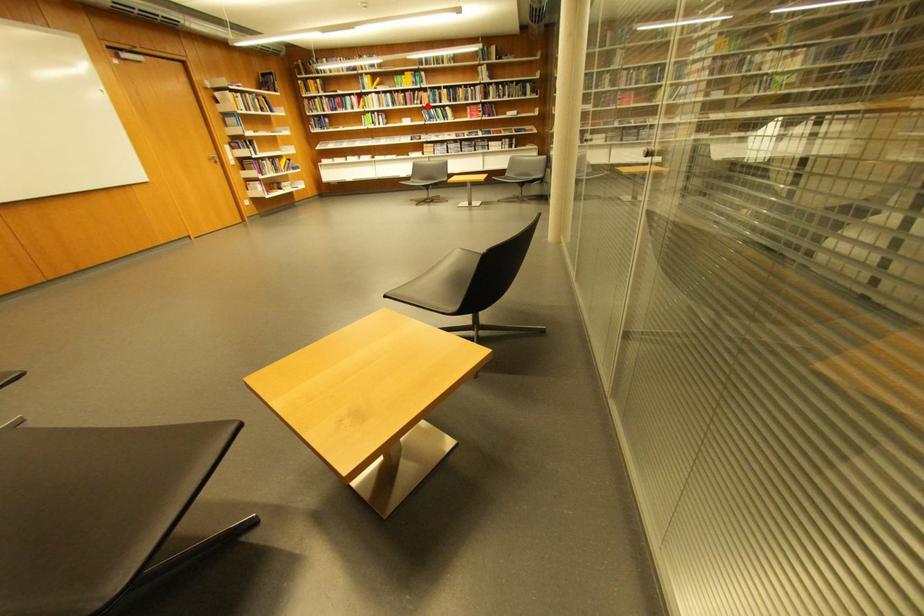
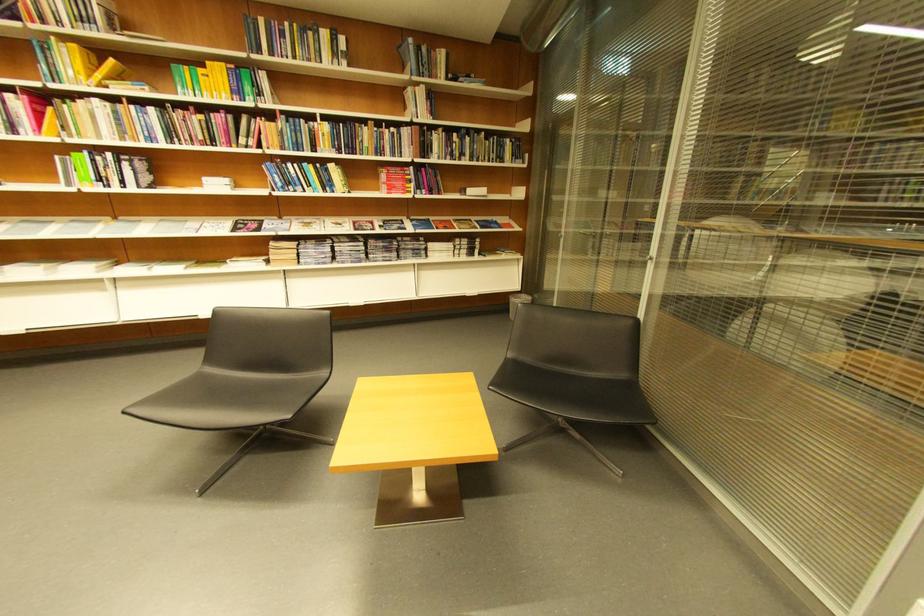
In the second image, find the point that corresponds to the highlighted location in the first image.

(258, 148)